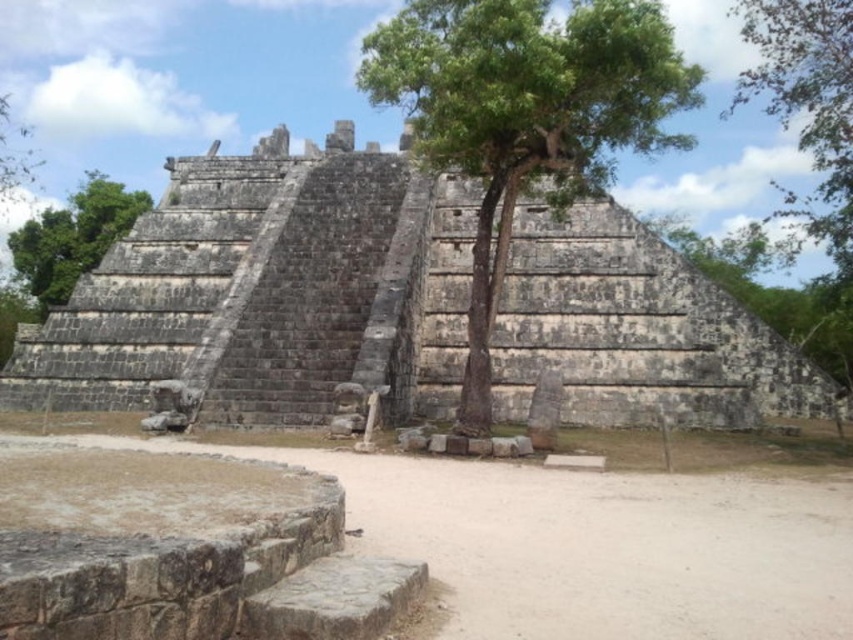
Consider the image. You are standing at the base of the pyramid and want to take a photo that includes both the green leafy tree at upper right and the green leafy tree at upper left. Which tree should you position closer to the center of your camera frame to ensure both are visible?

You should position the green leafy tree at upper left closer to the center of your camera frame because it is above the green leafy tree at upper right, allowing both to be captured in the frame when centered on the higher one.

You are an archaeologist examining the ancient pyramid site. You need to determine the relative positions of the gray stone ruins at center and the green leafy tree at upper right. Which object is positioned to the left of the other?

The gray stone ruins at center are to the left of the green leafy tree at upper right.